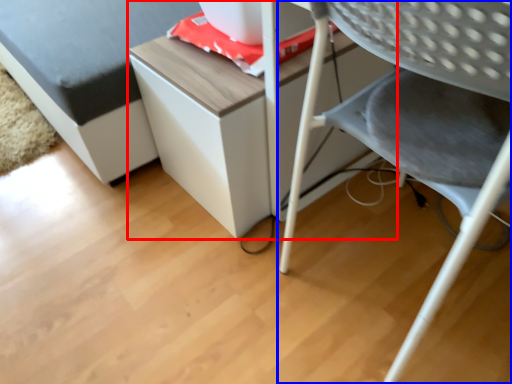
Question: Which point is closer to the camera, table (highlighted by a red box) or chair (highlighted by a blue box)?

Choices:
 (A) table
 (B) chair

Answer: (B)